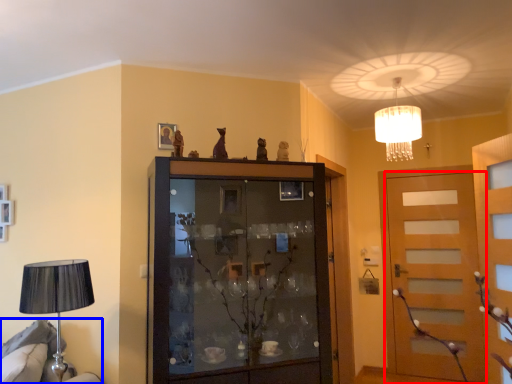
Question: Which of the following is the closest to the observer, door (highlighted by a red box) or furniture (highlighted by a blue box)?

Choices:
 (A) door
 (B) furniture

Answer: (B)